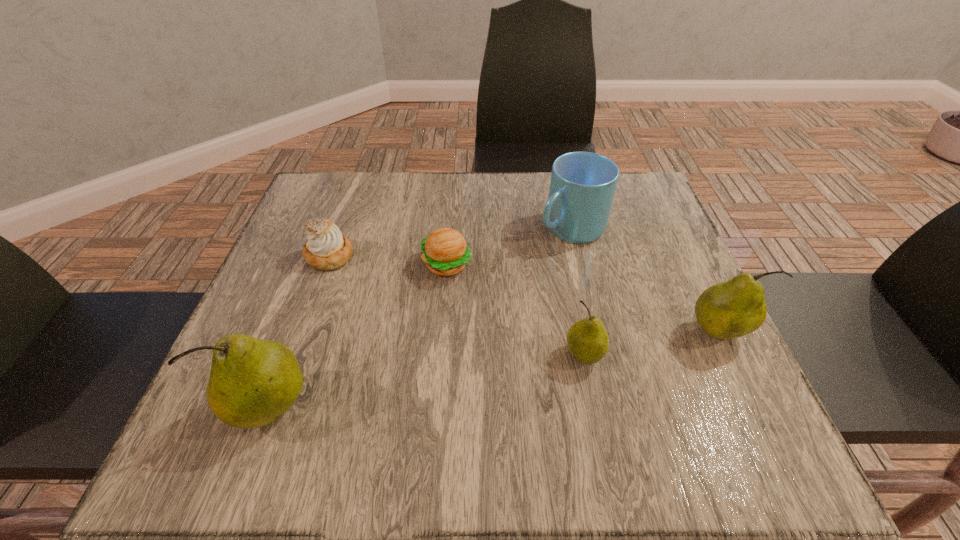
If equal spacing is the goal by inserting an additional pear among them, please point out a vacant space for this new pear. Please provide its 2D coordinates. Your answer should be formatted as a tuple, i.e. [(x, y)], where the tuple contains the x and y coordinates of a point satisfying the conditions above.

[(436, 380)]